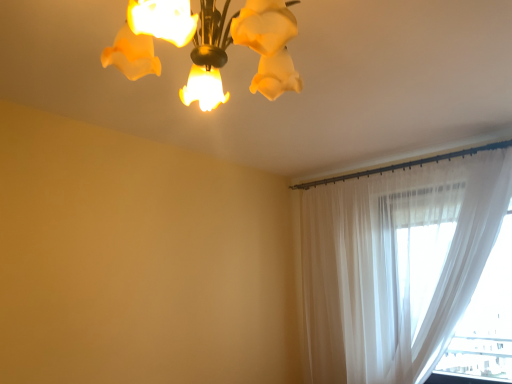
In order to face matte glass chandelier at upper center, should I rotate leftwards or rightwards?

To face it directly, rotate left by 5.223 degrees.

The height and width of the screenshot is (384, 512). In order to click on matte glass chandelier at upper center in this screenshot , I will do `click(208, 45)`.

The width and height of the screenshot is (512, 384). Describe the element at coordinates (208, 45) in the screenshot. I see `matte glass chandelier at upper center` at that location.

In order to face sheer white curtain at right, should I rotate leftwards or rightwards?

Rotate right and turn 18.882 degrees.

Identify the location of sheer white curtain at right. (397, 264).

What do you see at coordinates (397, 264) in the screenshot? The height and width of the screenshot is (384, 512). I see `sheer white curtain at right` at bounding box center [397, 264].

What are the coordinates of `matte glass chandelier at upper center` in the screenshot? It's located at (208, 45).

Which object is positioned more to the left, matte glass chandelier at upper center or sheer white curtain at right?

matte glass chandelier at upper center is more to the left.

Which object is further away from the camera, matte glass chandelier at upper center or sheer white curtain at right?

sheer white curtain at right is further from the camera.

Considering the positions of points (269, 69) and (394, 358), is point (269, 69) closer to camera compared to point (394, 358)?

Yes, it is in front of point (394, 358).

From the picture: From the image's perspective, is matte glass chandelier at upper center located beneath sheer white curtain at right?

No, from the image's perspective, matte glass chandelier at upper center is not beneath sheer white curtain at right.

From a real-world perspective, is matte glass chandelier at upper center positioned above or below sheer white curtain at right?

matte glass chandelier at upper center is situated higher than sheer white curtain at right in the real world.

Is matte glass chandelier at upper center wider or thinner than sheer white curtain at right?

Considering their sizes, matte glass chandelier at upper center looks broader than sheer white curtain at right.

Is matte glass chandelier at upper center taller than sheer white curtain at right?

No, matte glass chandelier at upper center is not taller than sheer white curtain at right.

Based on their sizes in the image, would you say matte glass chandelier at upper center is bigger or smaller than sheer white curtain at right?

Clearly, matte glass chandelier at upper center is smaller in size than sheer white curtain at right.

Which is correct: matte glass chandelier at upper center is inside sheer white curtain at right, or outside of it?

matte glass chandelier at upper center is not inside sheer white curtain at right, it's outside.

Are matte glass chandelier at upper center and sheer white curtain at right located far from each other?

Yes.

Could you tell me if matte glass chandelier at upper center is facing sheer white curtain at right?

No, matte glass chandelier at upper center is not oriented towards sheer white curtain at right.

Where is `lamp that is in front of the sheer white curtain at right`? This screenshot has width=512, height=384. lamp that is in front of the sheer white curtain at right is located at coordinates (208, 45).

Considering the positions of objects sheer white curtain at right and matte glass chandelier at upper center in the image provided, who is more to the left, sheer white curtain at right or matte glass chandelier at upper center?

matte glass chandelier at upper center.

Relative to matte glass chandelier at upper center, is sheer white curtain at right in front or behind?

Clearly, sheer white curtain at right is behind matte glass chandelier at upper center.

Is point (319, 298) closer or farther from the camera than point (215, 86)?

Point (319, 298).

From the image's perspective, is sheer white curtain at right positioned above or below matte glass chandelier at upper center?

sheer white curtain at right is situated lower than matte glass chandelier at upper center in the image.

From a real-world perspective, between sheer white curtain at right and matte glass chandelier at upper center, who is vertically higher?

matte glass chandelier at upper center.

Which of these two, sheer white curtain at right or matte glass chandelier at upper center, is wider?

matte glass chandelier at upper center.

Considering the sizes of objects sheer white curtain at right and matte glass chandelier at upper center in the image provided, who is taller, sheer white curtain at right or matte glass chandelier at upper center?

With more height is sheer white curtain at right.

Does sheer white curtain at right have a smaller size compared to matte glass chandelier at upper center?

No.

Is sheer white curtain at right not within matte glass chandelier at upper center?

That's correct, sheer white curtain at right is outside of matte glass chandelier at upper center.

Is sheer white curtain at right not close to matte glass chandelier at upper center?

Yes, sheer white curtain at right is far from matte glass chandelier at upper center.

Is sheer white curtain at right positioned with its back to matte glass chandelier at upper center?

That's not correct — sheer white curtain at right is not looking away from matte glass chandelier at upper center.

Find the location of a particular element. The height and width of the screenshot is (384, 512). lamp above the sheer white curtain at right (from the image's perspective) is located at coordinates (208, 45).

At what (x,y) coordinates should I click in order to perform the action: click on lamp on the left side of sheer white curtain at right. Please return your answer as a coordinate pair (x, y). The height and width of the screenshot is (384, 512). Looking at the image, I should click on (208, 45).

Identify the location of curtain on the right of matte glass chandelier at upper center. (397, 264).